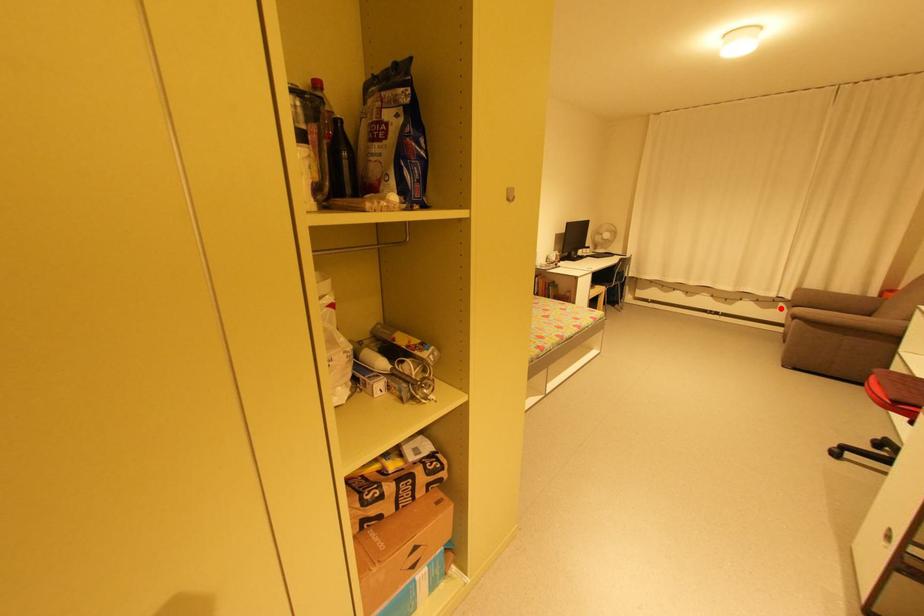
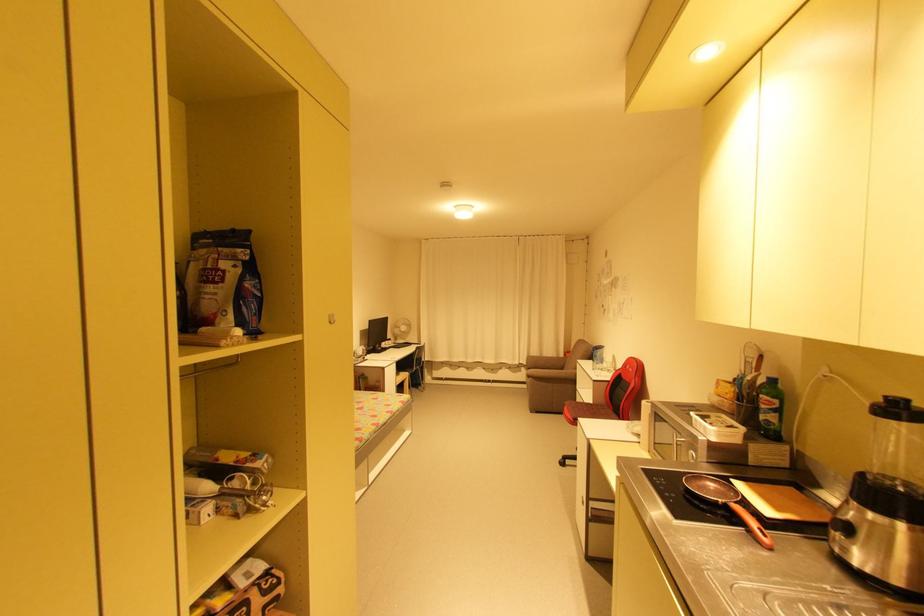
In the second image, find the point that corresponds to the highlighted location in the first image.

(525, 371)